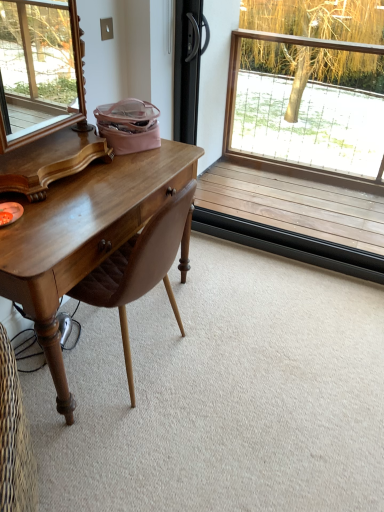
You are a GUI agent. You are given a task and a screenshot of the screen. Output one action in this format:
    pyautogui.click(x=<x>, y=<y>)
    Task: Click on the vacant space to the right of brown leather chair at left
    
    Given the screenshot: What is the action you would take?
    pyautogui.click(x=236, y=357)